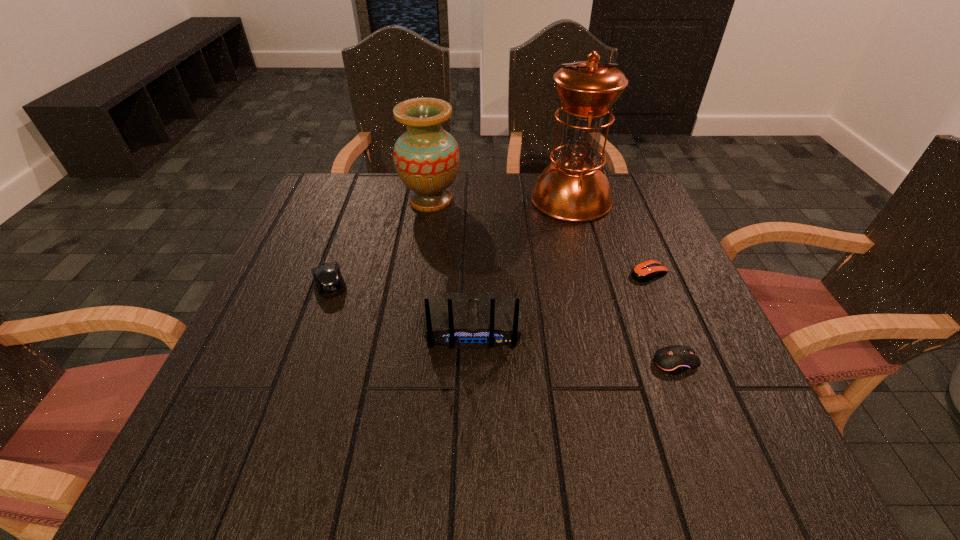
Find the location of a particular element. blank area located 0.050m on the back of the router is located at coordinates (472, 377).

Image resolution: width=960 pixels, height=540 pixels. I want to click on blank area located on the back of the tallest computer mouse, so click(360, 198).

Locate an element on the screen. vacant area situated 0.130m on the left of the nearest computer mouse is located at coordinates (583, 363).

At what (x,y) coordinates should I click in order to perform the action: click on free region located on the back of the shortest object. Please return your answer as a coordinate pair (x, y). The image size is (960, 540). Looking at the image, I should click on (618, 198).

The height and width of the screenshot is (540, 960). What are the coordinates of `oil lamp present at the far edge` in the screenshot? It's located at (574, 188).

At what (x,y) coordinates should I click in order to perform the action: click on vase at the far edge. Please return your answer as a coordinate pair (x, y). Looking at the image, I should click on (426, 157).

Find the location of a particular element. object at the left edge is located at coordinates (329, 281).

Locate an element on the screen. The width and height of the screenshot is (960, 540). oil lamp present at the right edge is located at coordinates (574, 188).

Identify the location of object located in the far right corner section of the desktop. (574, 188).

Where is `vacant area at the far edge`? vacant area at the far edge is located at coordinates (460, 178).